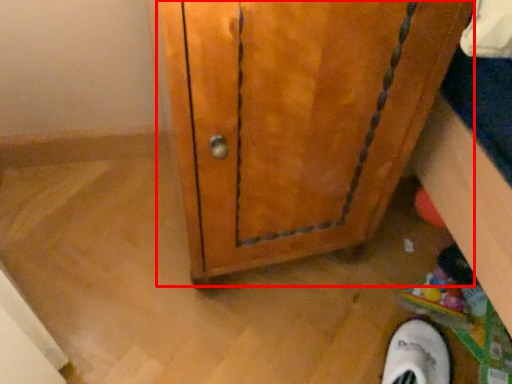
Question: Where is door (annotated by the red box) located in relation to footwear in the image?

Choices:
 (A) left
 (B) right

Answer: (A)